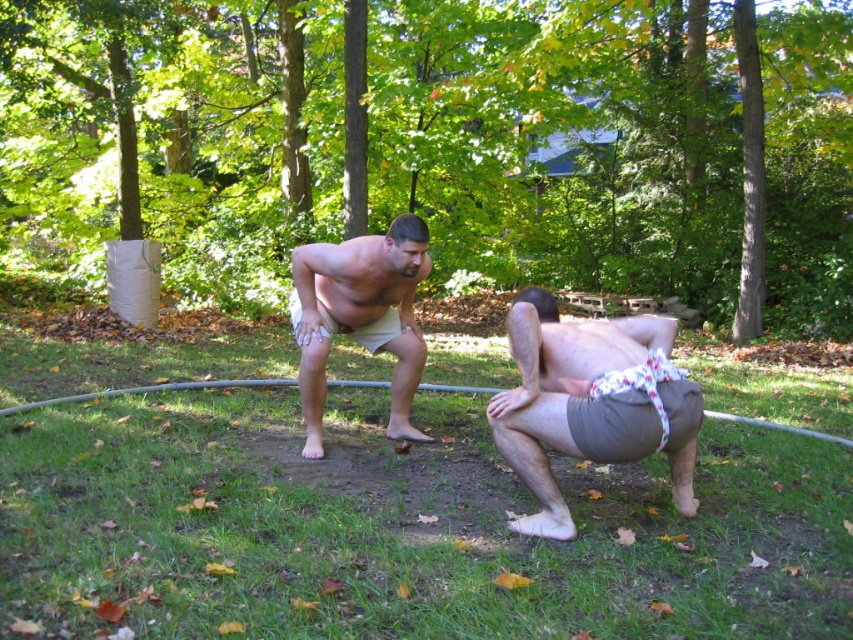
You are a photographer trying to capture a photo of the green grass at center and the brown cotton shorts at lower right. Which object is closer to the camera lens?

The brown cotton shorts at lower right are closer to the camera lens because the green grass at center is located below them, indicating they are positioned further away.

You are a photographer standing at the edge of the grassy area. You want to take a photo of both the green grass at center and the brown cotton shorts at lower right in the same frame. Can you ensure both are in focus if your camera has a depth of field that can cover 36 inches?

The green grass at center and brown cotton shorts at lower right are 36.34 inches apart. Since the camera can cover 36 inches, the distance between them slightly exceeds the depth of field. Therefore, both might not be fully in focus.